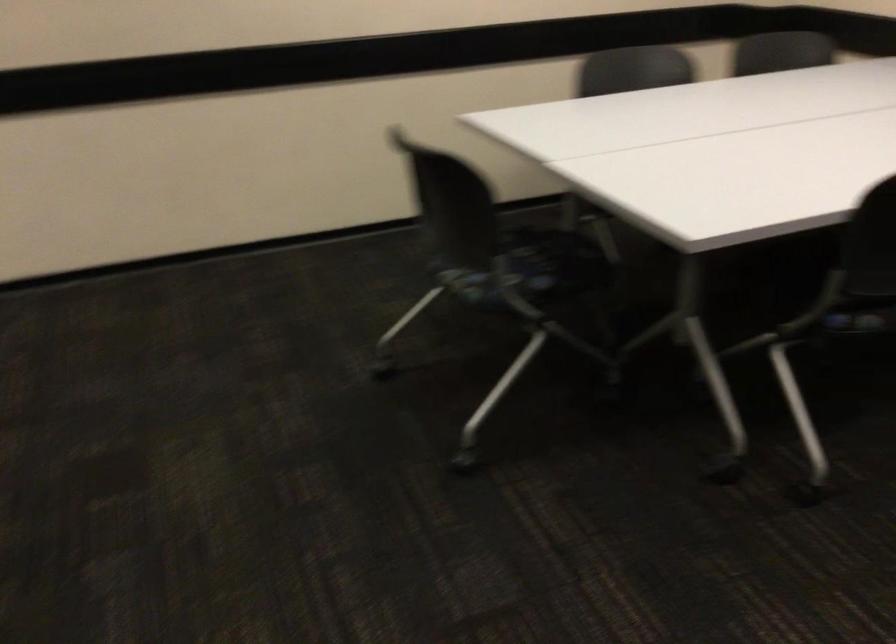
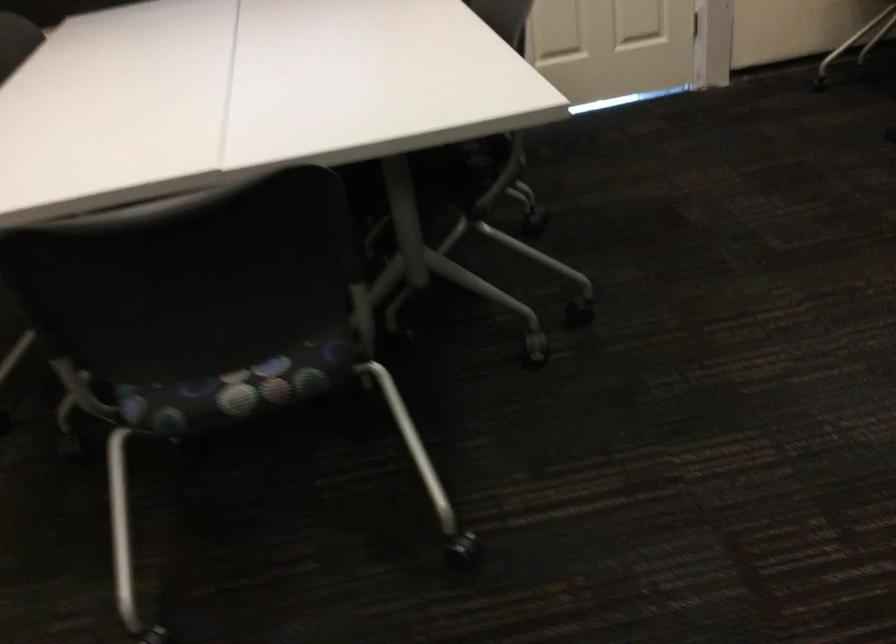
The point at (x=467, y=281) is marked in the first image. Where is the corresponding point in the second image?

(234, 389)